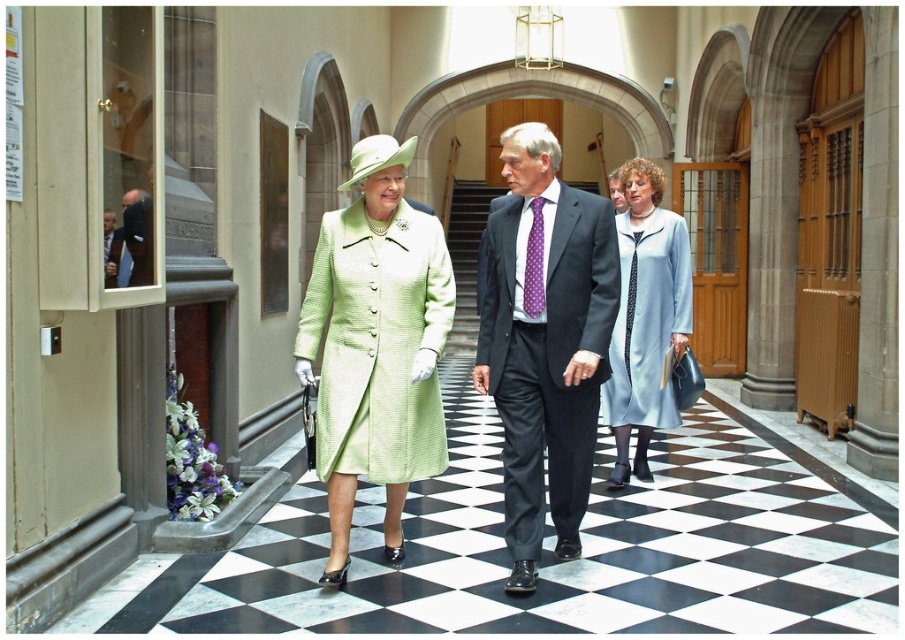
You are a photographer positioned at the end of the corridor near the arched window. You want to take a photo of the dark gray suit at center and lime green textured coat at center such that both are clearly visible. Which person should you focus on first to ensure they are in focus?

The dark gray suit at center is in front of the lime green textured coat at center, so you should focus on the dark gray suit at center first to ensure both are in focus.

You are standing at the entrance of the corridor and want to approach the light blue fabric dress at center and the purple dotted tie at center. Which one should you walk towards first to reach the closest object?

The light blue fabric dress at center is closer to you than the purple dotted tie at center, so you should walk towards the light blue fabric dress at center first.

You are standing at the entrance of the corridor and see the point marked at coordinates (645, 317). Based on the scene description, what object or feature is located at that point?

The point at coordinates (645, 317) marks the location of the light blue fabric dress at center.